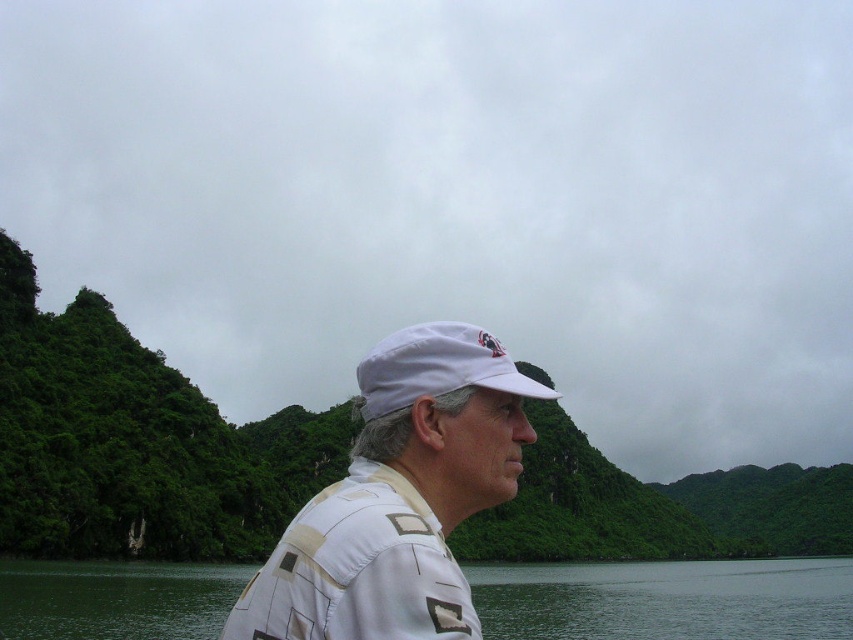
Question: Which of the following is the farthest from the observer?

Choices:
 (A) transparent water at center
 (B) white matte cap at center

Answer: (A)

Question: Is the position of transparent water at center less distant than that of white fabric cap at center?

Choices:
 (A) yes
 (B) no

Answer: (B)

Question: Can you confirm if white matte cap at center is wider than transparent water at center?

Choices:
 (A) yes
 (B) no

Answer: (B)

Question: Estimate the real-world distances between objects in this image. Which object is closer to the transparent water at center?

Choices:
 (A) white fabric cap at center
 (B) white matte cap at center

Answer: (B)

Question: Does white matte cap at center appear over transparent water at center?

Choices:
 (A) yes
 (B) no

Answer: (A)

Question: Which object is positioned closest to the white fabric cap at center?

Choices:
 (A) white matte cap at center
 (B) transparent water at center

Answer: (A)